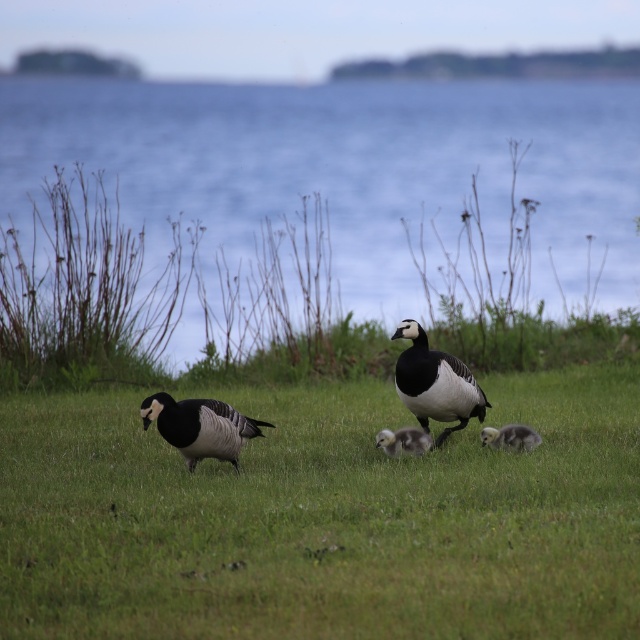
Question: Does blue water at upper center appear under soft gray downy duckling at center?

Choices:
 (A) no
 (B) yes

Answer: (A)

Question: Which of the following is the closest to the observer?

Choices:
 (A) green grass at center
 (B) black glossy duckling at center
 (C) soft gray downy gosling at lower right

Answer: (A)

Question: Does blue water at upper center appear under black glossy goose at center?

Choices:
 (A) yes
 (B) no

Answer: (B)

Question: Which point is closer to the camera?

Choices:
 (A) (470, 410)
 (B) (384, 124)

Answer: (A)

Question: Among these points, which one is nearest to the camera?

Choices:
 (A) (348, 188)
 (B) (161, 572)

Answer: (B)

Question: Is green grass at center bigger than blue water at upper center?

Choices:
 (A) no
 (B) yes

Answer: (A)